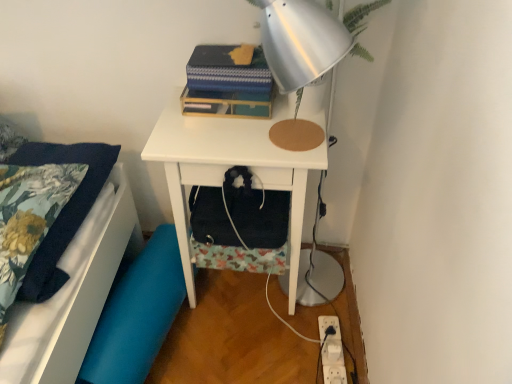
Question: Considering the relative sizes of silver metallic lamp at upper center and blue fabric swivel chair at lower left in the image provided, is silver metallic lamp at upper center wider than blue fabric swivel chair at lower left?

Choices:
 (A) no
 (B) yes

Answer: (B)

Question: Does silver metallic lamp at upper center have a lesser width compared to blue fabric swivel chair at lower left?

Choices:
 (A) yes
 (B) no

Answer: (B)

Question: Is silver metallic lamp at upper center at the right side of blue fabric swivel chair at lower left?

Choices:
 (A) no
 (B) yes

Answer: (B)

Question: Is silver metallic lamp at upper center with blue fabric swivel chair at lower left?

Choices:
 (A) no
 (B) yes

Answer: (A)

Question: Can you confirm if silver metallic lamp at upper center is shorter than blue fabric swivel chair at lower left?

Choices:
 (A) no
 (B) yes

Answer: (A)

Question: Is silver metallic lamp at upper center positioned with its back to blue fabric swivel chair at lower left?

Choices:
 (A) no
 (B) yes

Answer: (A)

Question: Could you tell me if blue fabric swivel chair at lower left is facing silver metallic lamp at upper center?

Choices:
 (A) no
 (B) yes

Answer: (A)

Question: Is blue fabric swivel chair at lower left closer to the viewer compared to silver metallic lamp at upper center?

Choices:
 (A) no
 (B) yes

Answer: (A)

Question: Can you confirm if blue fabric swivel chair at lower left is taller than silver metallic lamp at upper center?

Choices:
 (A) no
 (B) yes

Answer: (A)

Question: From the image's perspective, would you say blue fabric swivel chair at lower left is shown under silver metallic lamp at upper center?

Choices:
 (A) no
 (B) yes

Answer: (B)

Question: From the image's perspective, is blue fabric swivel chair at lower left on top of silver metallic lamp at upper center?

Choices:
 (A) yes
 (B) no

Answer: (B)

Question: Is blue fabric swivel chair at lower left bigger than silver metallic lamp at upper center?

Choices:
 (A) yes
 (B) no

Answer: (A)

Question: From a real-world perspective, is silver metallic lamp at upper center physically above floral fabric pillowcase at left?

Choices:
 (A) no
 (B) yes

Answer: (B)